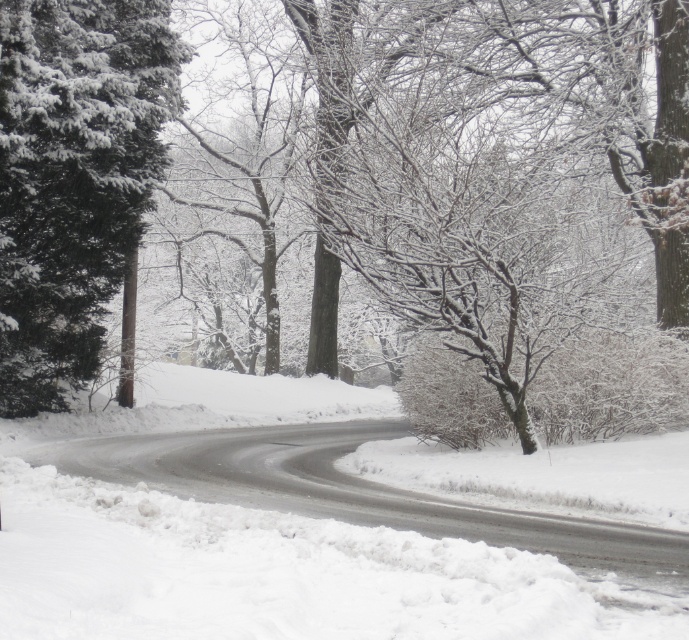
You are an observer standing at the edge of the road in the winter scene. You notice the white fluffy snow at center and the green matte evergreen tree at left. Which of these two objects is taller?

The green matte evergreen tree at left is taller than the white fluffy snow at center.

You are a photographer wanting to capture the white fluffy snow at center and the green matte evergreen tree at left in the same frame. Which object will appear larger in the photo?

The white fluffy snow at center will appear larger in the photo because it is bigger than the green matte evergreen tree at left.